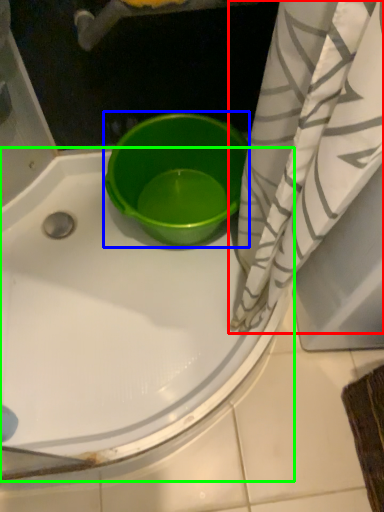
Question: Considering the real-world distances, which object is closest to curtain (highlighted by a red box)? basin (highlighted by a blue box) or bathtub (highlighted by a green box).

Choices:
 (A) basin
 (B) bathtub

Answer: (A)